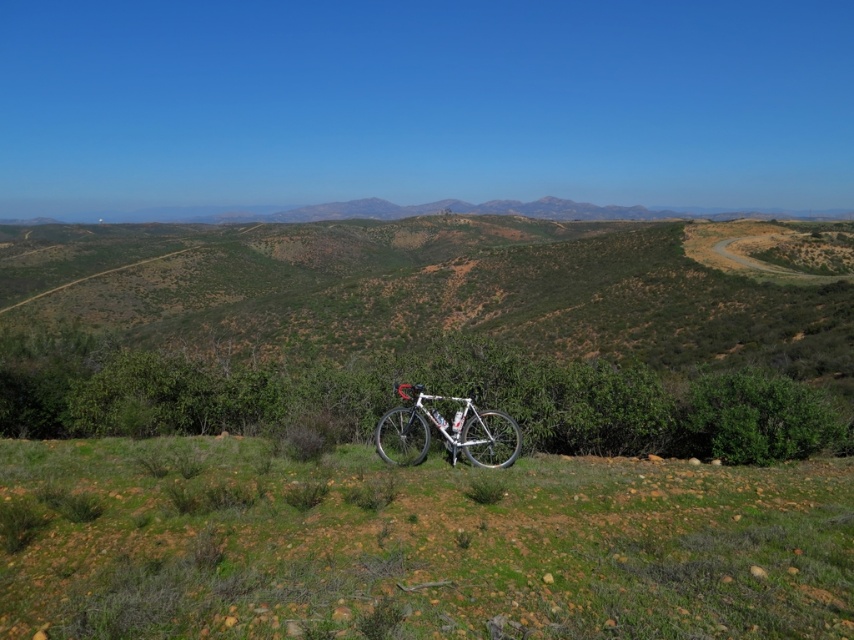
You are planning to set up a small tent in the scene. You have two options for placement based on the objects present. The first option is near the green grassy at lower center, and the second is near the white metallic bicycle at center. Which location would provide more space for the tent? Please explain your reasoning using the objects mentioned.

The green grassy at lower center has a larger width than the white metallic bicycle at center, so setting up the tent near the green grassy at lower center would provide more space for the tent.